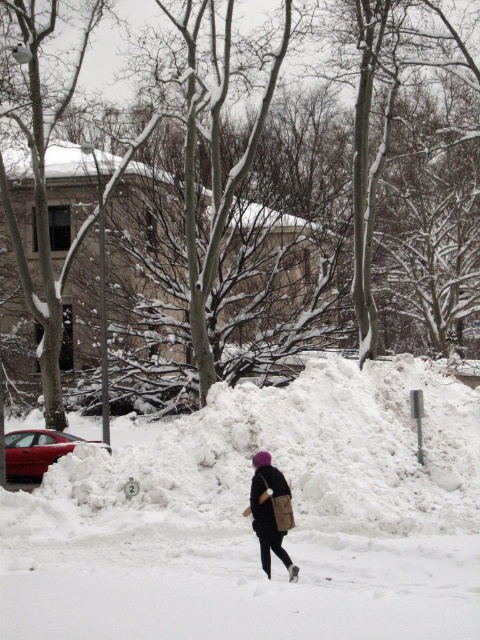
Is white fluffy snow at center bigger than dark brown leather jacket at center?

Yes, white fluffy snow at center is bigger than dark brown leather jacket at center.

Which is in front, point (348, 451) or point (263, 451)?

Point (263, 451) is more forward.

In order to click on white fluffy snow at center in this screenshot , I will do `click(250, 524)`.